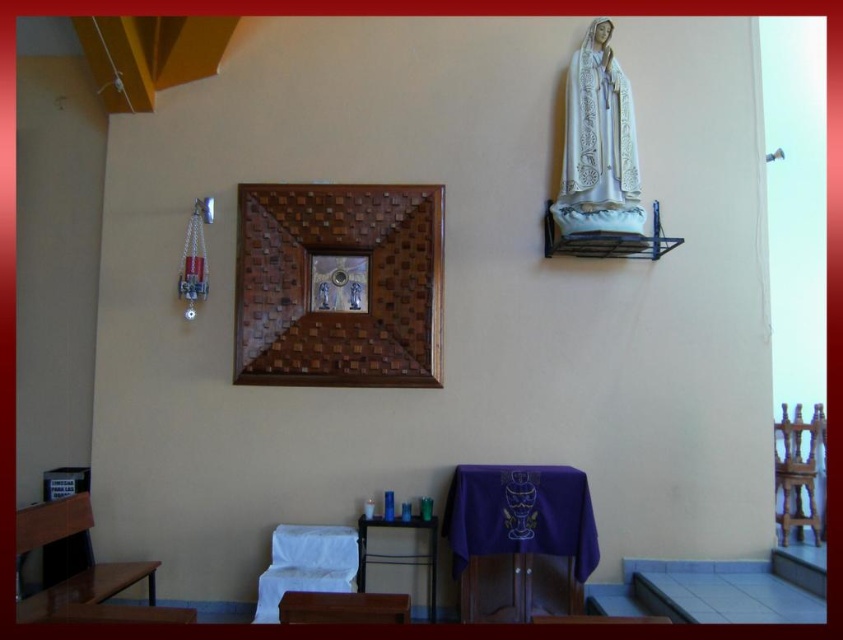
Question: Does woven wood picture frame at upper center have a larger size compared to wooden chair at right?

Choices:
 (A) no
 (B) yes

Answer: (B)

Question: Among these objects, which one is nearest to the camera?

Choices:
 (A) woven wood picture frame at upper center
 (B) wooden chair at right
 (C) white fabric chair at lower center

Answer: (C)

Question: Is the position of white lace robe at upper right less distant than that of white fabric chair at lower center?

Choices:
 (A) no
 (B) yes

Answer: (A)

Question: Which point is farther to the camera?

Choices:
 (A) white lace robe at upper right
 (B) white fabric chair at lower center

Answer: (A)

Question: Can you confirm if woven wood picture frame at upper center is positioned to the right of white lace robe at upper right?

Choices:
 (A) no
 (B) yes

Answer: (A)

Question: Which point is farther to the camera?

Choices:
 (A) (595, 84)
 (B) (809, 499)
 (C) (358, 212)

Answer: (B)